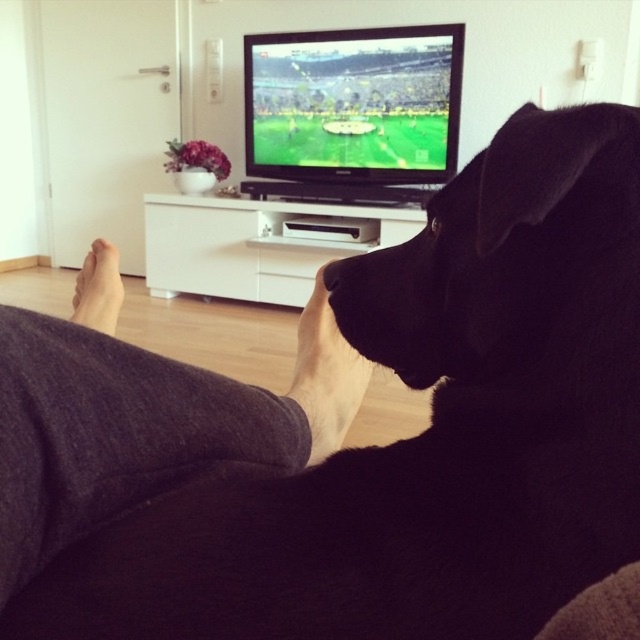
You are a photographer trying to capture a candid shot of the dark gray fabric leg at lower left and the green grass field at center. Which object is located to the left of the other?

The dark gray fabric leg at lower left is positioned on the left side of green grass field at center.

You are a robotic vacuum cleaner in the living room. You need to move from the dark gray fabric leg at lower left to the black matte skin at lower center. Which direction should you move to avoid obstacles?

The dark gray fabric leg at lower left is shorter than the black matte skin at lower center, so you should move upwards to reach the black matte skin at lower center while avoiding obstacles.

Based on the scene description, can you determine the exact 2D coordinates of the dark gray fabric leg at lower left?

The dark gray fabric leg at lower left is located at the 2D coordinates of point (145, 424).